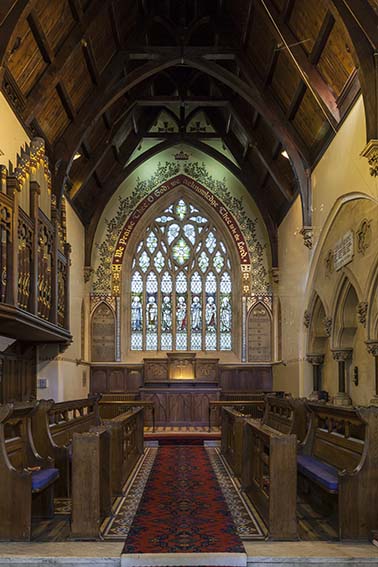
This screenshot has width=378, height=567. Find the location of `seat of pew`. seat of pew is located at coordinates [x=319, y=468], [x=45, y=475], [x=68, y=446], [x=266, y=447].